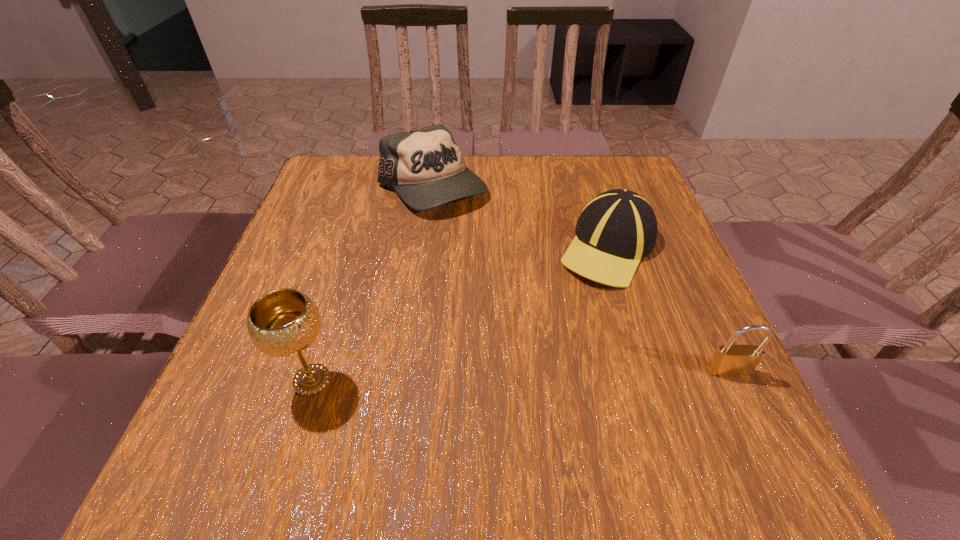
This screenshot has width=960, height=540. In order to click on free space at the far edge of the desktop in this screenshot , I will do `click(540, 185)`.

This screenshot has width=960, height=540. In the image, there is a desktop. Find the location of `vacant space at the near edge`. vacant space at the near edge is located at coordinates (390, 393).

Where is `vacant space at the left edge of the desktop`? This screenshot has height=540, width=960. vacant space at the left edge of the desktop is located at coordinates (348, 260).

Where is `vacant area at the right edge of the desktop`? This screenshot has height=540, width=960. vacant area at the right edge of the desktop is located at coordinates (663, 302).

This screenshot has height=540, width=960. In order to click on free space at the far left corner in this screenshot , I will do `click(330, 185)`.

Identify the location of vacant space at the near left corner of the desktop. The height and width of the screenshot is (540, 960). (303, 417).

At what (x,y) coordinates should I click in order to perform the action: click on free region at the far right corner. Please return your answer as a coordinate pair (x, y). Looking at the image, I should click on (613, 183).

Image resolution: width=960 pixels, height=540 pixels. Find the location of `free space between the right baseball cap and the tallest object`. free space between the right baseball cap and the tallest object is located at coordinates (460, 314).

This screenshot has width=960, height=540. In order to click on free space between the left baseball cap and the right baseball cap in this screenshot , I will do `click(520, 218)`.

Where is `free space that is in between the tallest object and the left baseball cap`? This screenshot has width=960, height=540. free space that is in between the tallest object and the left baseball cap is located at coordinates (372, 284).